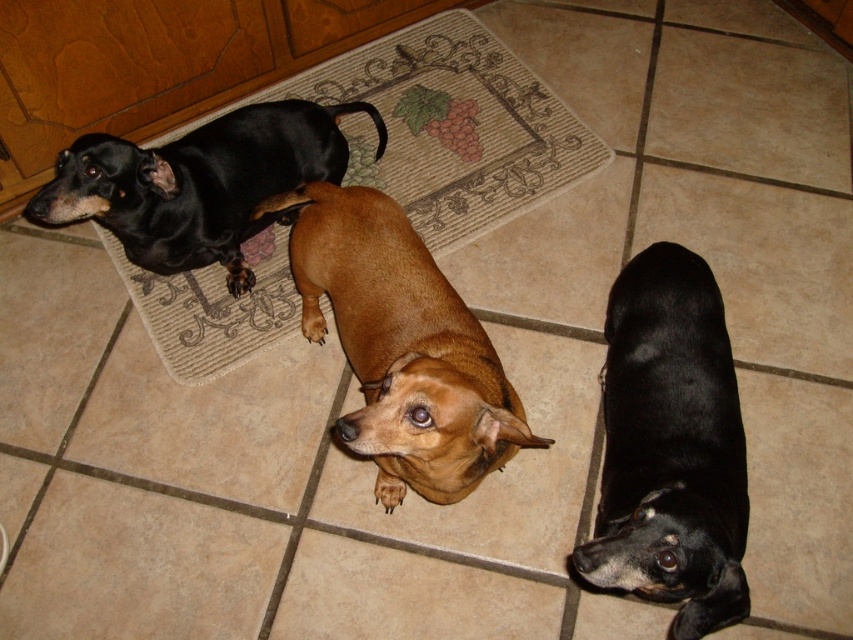
You are a photographer trying to capture a photo of the two black dogs in the scene. You want to ensure that both the black matte dog at lower right and the shiny black dog at upper left are visible in the frame. Based on their positions, which dog should you position closer to the center of the image to include both?

Since the black matte dog at lower right is to the right of the shiny black dog at upper left, you should position the shiny black dog at upper left closer to the center to ensure both dogs are visible in the frame.

In the scene shown: You are a photographer standing at the center of the room. You want to take a photo of the brown smooth dog at center. Where should you aim your camera to capture it perfectly?

The brown smooth dog at center is located at point (401, 346), so you should aim your camera at those coordinates to capture it perfectly.

You are a photographer taking a picture of the black matte dog at lower right and the shiny black dog at upper left. Which dog will appear larger in the photo?

The black matte dog at lower right will appear larger in the photo because it is closer to the viewer than the shiny black dog at upper left.